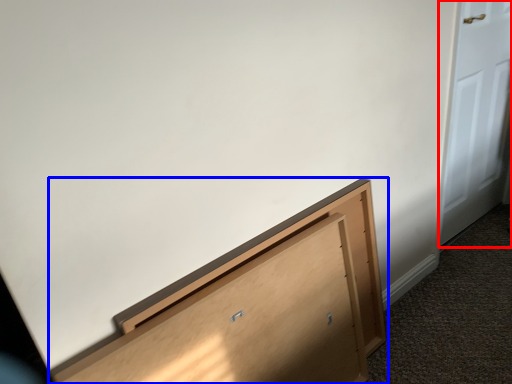
Question: Which of the following is the closest to the observer, door (highlighted by a red box) or furniture (highlighted by a blue box)?

Choices:
 (A) door
 (B) furniture

Answer: (B)